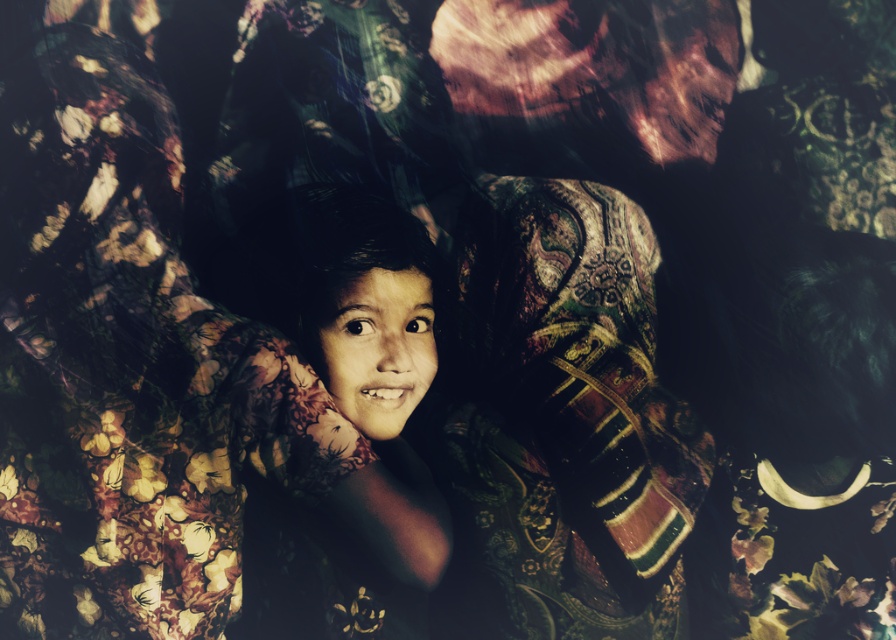
Question: Which object is closer to the camera taking this photo?

Choices:
 (A) richly embroidered fabric at center
 (B) smooth skin child at center

Answer: (B)

Question: Considering the relative positions of richly embroidered fabric at center and smooth skin child at center in the image provided, where is richly embroidered fabric at center located with respect to smooth skin child at center?

Choices:
 (A) left
 (B) right

Answer: (B)

Question: Can you confirm if richly embroidered fabric at center is positioned below smooth skin child at center?

Choices:
 (A) no
 (B) yes

Answer: (A)

Question: Which point is closer to the camera taking this photo?

Choices:
 (A) (490, 301)
 (B) (265, 576)

Answer: (B)

Question: Is richly embroidered fabric at center bigger than smooth skin child at center?

Choices:
 (A) yes
 (B) no

Answer: (A)